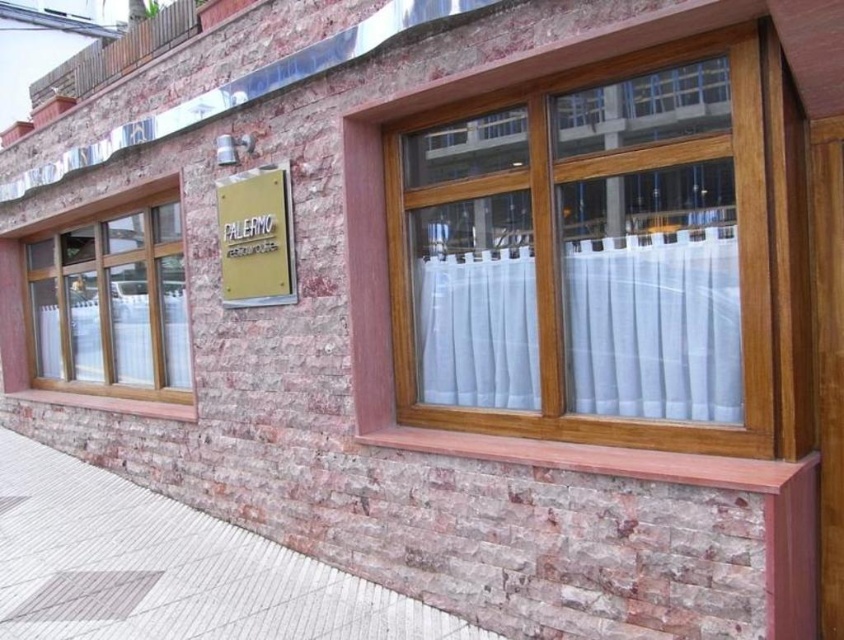
Question: Can you confirm if wooden frame at upper center is positioned below gold metallic sign at upper center?

Choices:
 (A) yes
 (B) no

Answer: (A)

Question: Which object appears farthest from the camera in this image?

Choices:
 (A) white sheer curtain at center
 (B) wooden frame window at left

Answer: (B)

Question: Does white concrete pavement at lower left have a lesser width compared to white sheer curtain at center?

Choices:
 (A) yes
 (B) no

Answer: (B)

Question: Where is wooden frame at upper center located in relation to white sheer curtain at center in the image?

Choices:
 (A) right
 (B) left

Answer: (B)

Question: Which of the following is the farthest from the observer?

Choices:
 (A) tap(637, 205)
 (B) tap(291, 241)
 (C) tap(504, 387)
 (D) tap(480, 632)

Answer: (B)

Question: Which object is the farthest from the gold metallic sign at upper center?

Choices:
 (A) white sheer curtain at center
 (B) wooden frame window at left

Answer: (B)